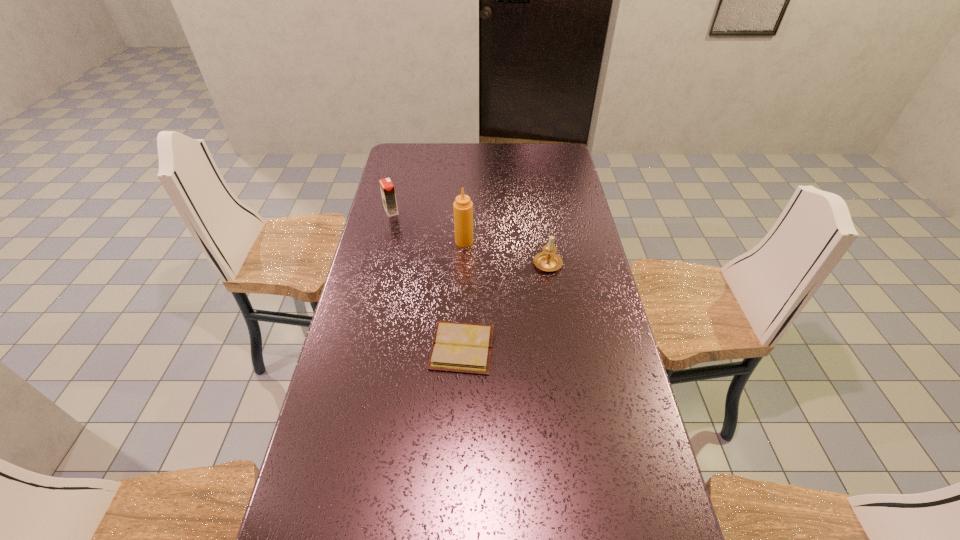
Locate an element on the screen. The width and height of the screenshot is (960, 540). condiment is located at coordinates (463, 207).

At what (x,y) coordinates should I click in order to perform the action: click on the tallest object. Please return your answer as a coordinate pair (x, y). Looking at the image, I should click on (463, 207).

Locate an element on the screen. the leftmost object is located at coordinates (387, 188).

This screenshot has height=540, width=960. I want to click on the farthest object, so click(387, 188).

What are the coordinates of `candle holder` in the screenshot? It's located at [548, 260].

Locate an element on the screen. the rightmost object is located at coordinates (548, 260).

Where is `the shortest object`? the shortest object is located at coordinates (457, 347).

The height and width of the screenshot is (540, 960). I want to click on the nearest object, so click(x=457, y=347).

Find the location of a particular element. The image size is (960, 540). vacant area located 0.190m on the front of the tallest object is located at coordinates (463, 285).

The image size is (960, 540). I want to click on free location located on the front of the orange juice, so click(380, 258).